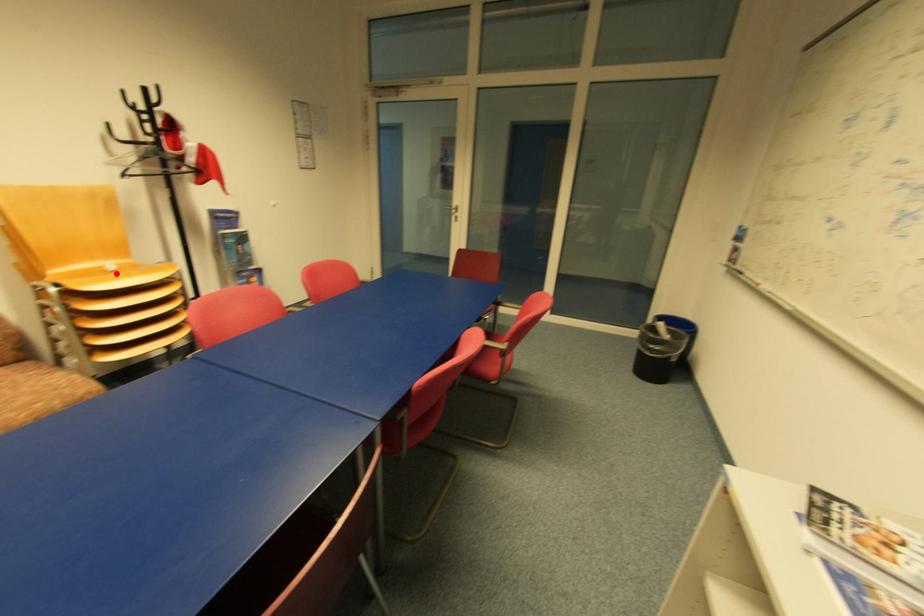
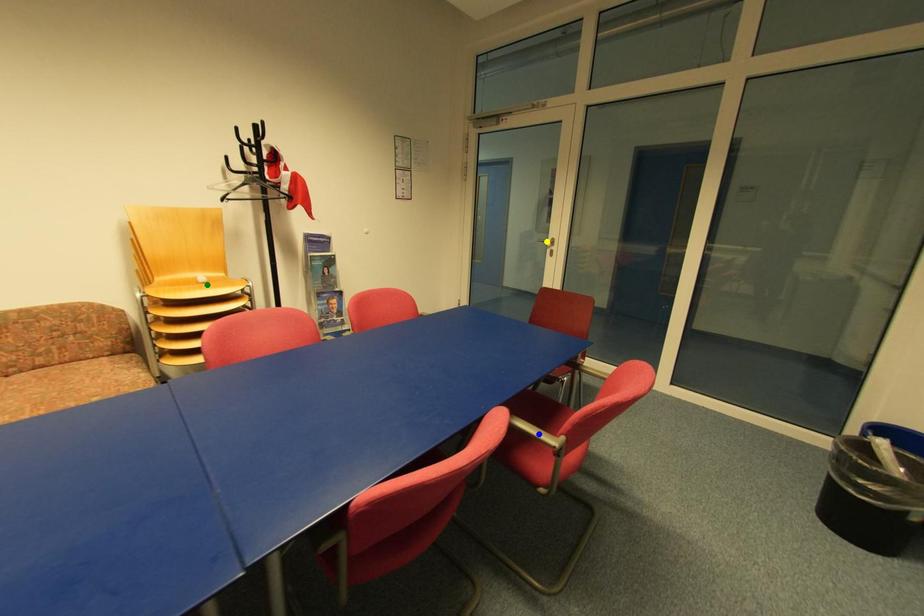
Question: I am providing you with two images of the same scene from different viewpoints. A red point is marked on the first image. You are given multiple points on the second image. Which spot in image 2 lines up with the point in image 1?

Choices:
 (A) yellow point
 (B) blue point
 (C) green point

Answer: (C)